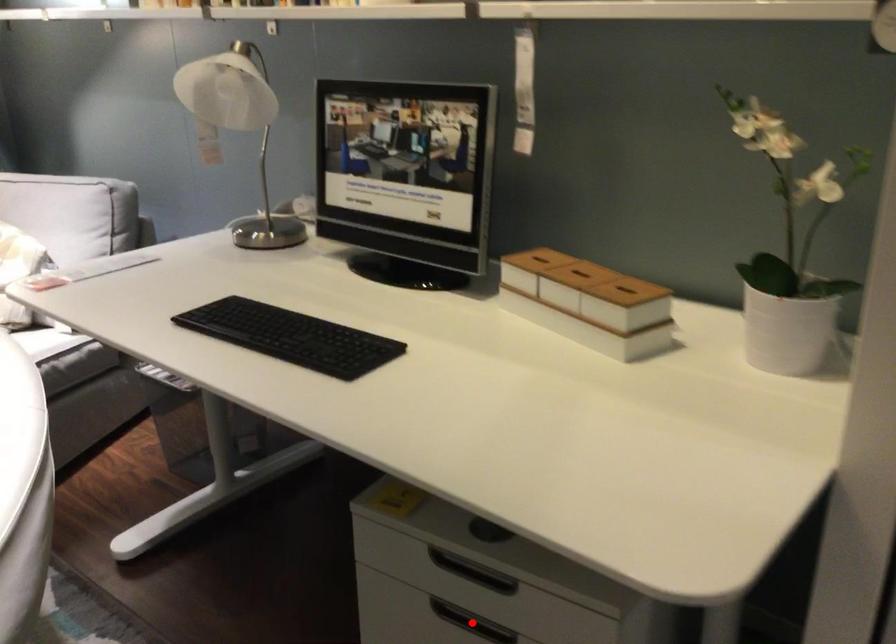
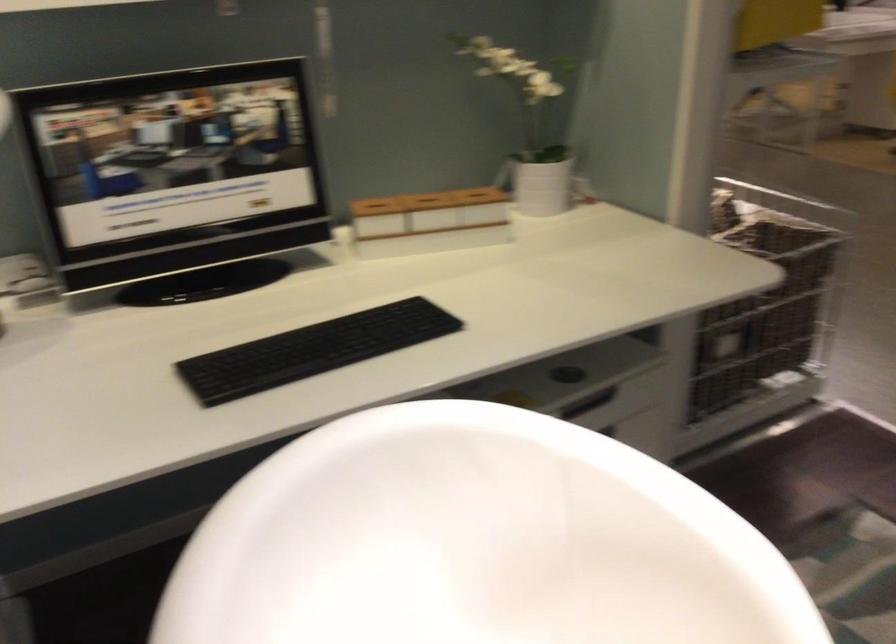
Question: I am providing you with two images of the same scene from different viewpoints. A red point is marked on the first image. Can you still see the location of the red point in image 2?

Choices:
 (A) Yes
 (B) No

Answer: (B)